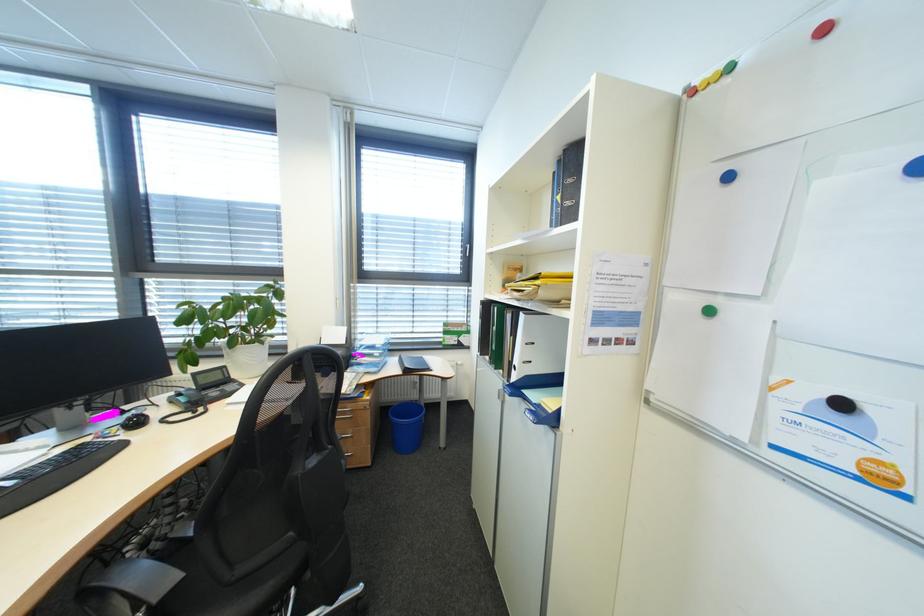
The location [727,177] corresponds to which object?

It refers to a blue circular magnet.